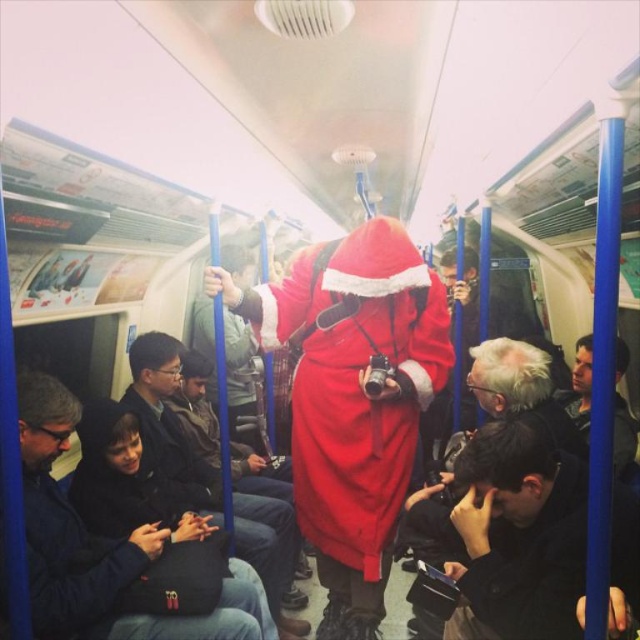
Who is positioned more to the right, velvet red santa at center or smooth black jacket at lower right?

smooth black jacket at lower right

Does point (429, 291) lie behind point (621, 456)?

No, (429, 291) is closer to viewer.

Locate an element on the screen. The width and height of the screenshot is (640, 640). velvet red santa at center is located at coordinates (353, 397).

Can you confirm if velvet red santa at center is taller than dark brown leather jacket at lower right?

Indeed, velvet red santa at center has a greater height compared to dark brown leather jacket at lower right.

Does point (360, 374) come farther from viewer compared to point (468, 596)?

That is True.

Who is more distant from viewer, (355,506) or (483,484)?

Positioned behind is point (355,506).

Locate an element on the screen. velvet red santa at center is located at coordinates (353, 397).

Who is positioned more to the right, velvet red santa at center or dark gray fabric jacket at lower left?

velvet red santa at center

Can you confirm if velvet red santa at center is positioned above dark gray fabric jacket at lower left?

Yes.

Image resolution: width=640 pixels, height=640 pixels. Find the location of `velvet red santa at center`. velvet red santa at center is located at coordinates (353, 397).